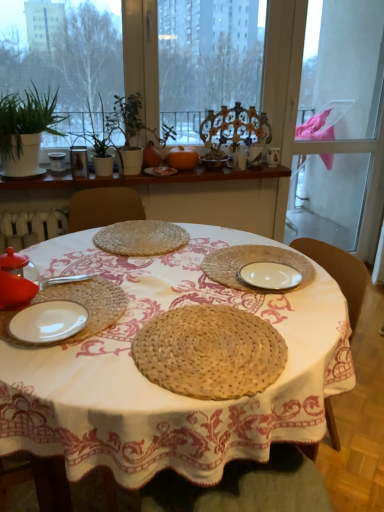
Question: Considering the positions of point (195, 159) and point (292, 251), is point (195, 159) closer or farther from the camera than point (292, 251)?

Choices:
 (A) closer
 (B) farther

Answer: (B)

Question: From a real-world perspective, is orange matte pumpkin at center physically located above or below white woven plate at center, which ranks as the 3th plate in top-to-bottom order?

Choices:
 (A) above
 (B) below

Answer: (A)

Question: Considering the real-world distances, which object is farthest from the white ceramic cup at upper center, the fourth tableware when ordered from front to back?

Choices:
 (A) matte brown bowl at center, the 3th tableware in the top-to-bottom sequence
 (B) woven straw placemat at center, the 4th plate in the front-to-back sequence
 (C) matte glass teapot at left, which is the fifth tableware in back-to-front order
 (D) woven straw placemat at center
 (E) orange matte pumpkin at center

Answer: (C)

Question: Which is farther from the matte ceramic mug at upper center, the fifth tableware in the bottom-to-top sequence?

Choices:
 (A) green leafy plant at upper left
 (B) matte glass vase at upper left, which appears as the 5th tableware when viewed from the right
 (C) green matte plant at upper left, which is the first plant in left-to-right order
 (D) white matte plate at center, which is counted as the fifth plate, starting from the front
 (E) transparent glass window screen at upper center

Answer: (A)